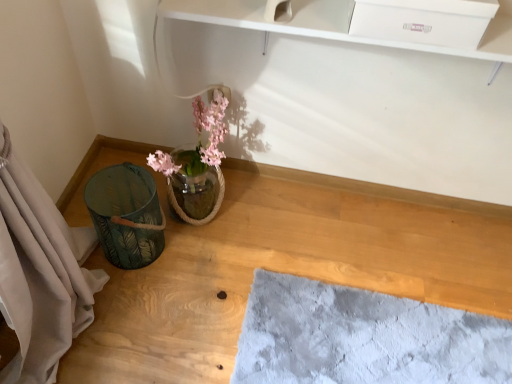
You are a GUI agent. You are given a task and a screenshot of the screen. Output one action in this format:
    pyautogui.click(x=<x>, y=<y>)
    Task: Click on the unoccupied area in front of translucent glass vase at center
    The width and height of the screenshot is (512, 384).
    Given the screenshot: What is the action you would take?
    pyautogui.click(x=184, y=288)